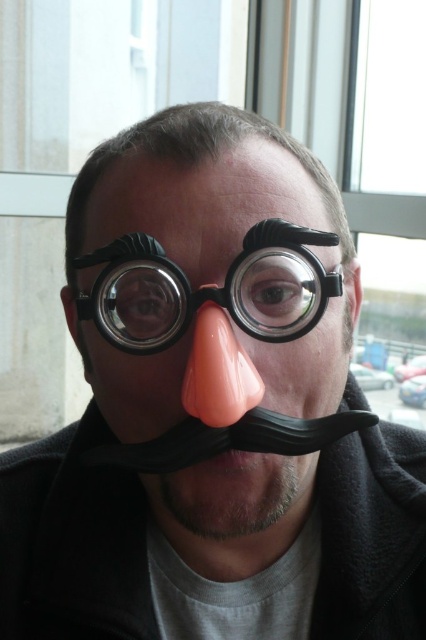
Question: Is rubber/matte clown nose at center above black plastic goggles at center?

Choices:
 (A) no
 (B) yes

Answer: (A)

Question: Which point appears farthest from the camera in this image?

Choices:
 (A) (157, 358)
 (B) (213, 397)
 (C) (218, 458)
 (D) (290, 305)

Answer: (A)

Question: Is black plastic goggles at center to the left of black rubber mustache at lower center from the viewer's perspective?

Choices:
 (A) yes
 (B) no

Answer: (A)

Question: Is black plastic goggles at center thinner than black rubber mustache at lower center?

Choices:
 (A) yes
 (B) no

Answer: (B)

Question: Based on their relative distances, which object is nearer to the black plastic goggles at center?

Choices:
 (A) pink rubber nose at center
 (B) rubber/matte clown nose at center

Answer: (A)

Question: Which of the following is the farthest from the observer?

Choices:
 (A) black plastic goggles at center
 (B) black rubber mustache at lower center
 (C) rubber/matte clown nose at center
 (D) pink rubber nose at center

Answer: (A)